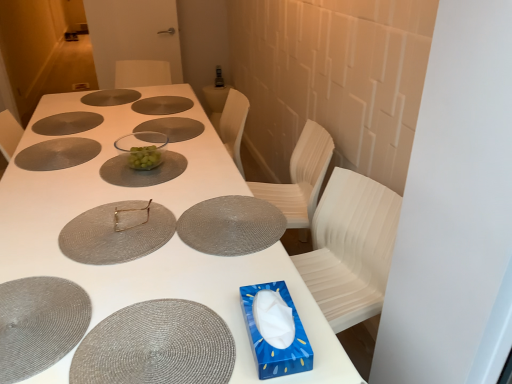
This screenshot has height=384, width=512. I want to click on vacant space that is in between matte gray glass plate at upper left, which is counted as the 7th glass plate, starting from the front, and transparent glass bowl at center, so click(94, 138).